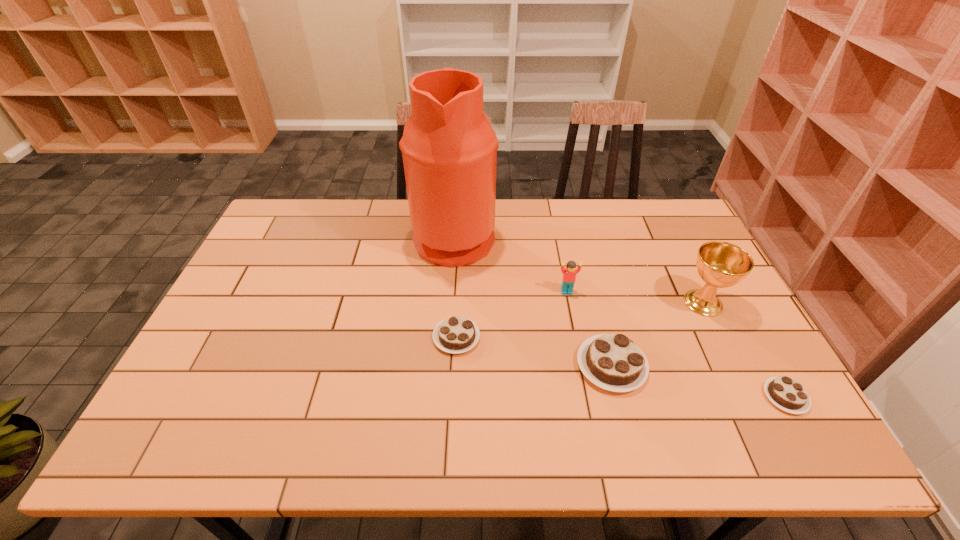
In the image, there is a desktop. What are the coordinates of `blank space at the far edge` in the screenshot? It's located at (387, 235).

The height and width of the screenshot is (540, 960). Find the location of `vacant space at the near edge of the desktop`. vacant space at the near edge of the desktop is located at coordinates (703, 389).

This screenshot has height=540, width=960. Find the location of `blank space at the left edge of the desktop`. blank space at the left edge of the desktop is located at coordinates (260, 346).

In the image, there is a desktop. Identify the location of vacant space at the right edge. The height and width of the screenshot is (540, 960). (698, 247).

This screenshot has width=960, height=540. I want to click on free spot at the far left corner of the desktop, so click(314, 229).

Locate an element on the screen. The height and width of the screenshot is (540, 960). vacant region at the far right corner of the desktop is located at coordinates (648, 207).

Find the location of a particular element. free point between the Lego and the second tallest object is located at coordinates (635, 297).

Image resolution: width=960 pixels, height=540 pixels. I want to click on unoccupied position between the farthest object and the second chocolate cake from right to left, so click(x=533, y=301).

Find the location of `free space between the tallest object and the fourth shortest object`. free space between the tallest object and the fourth shortest object is located at coordinates (511, 264).

Identify the location of blank region between the shortest chocolate cake and the farthest object. (620, 316).